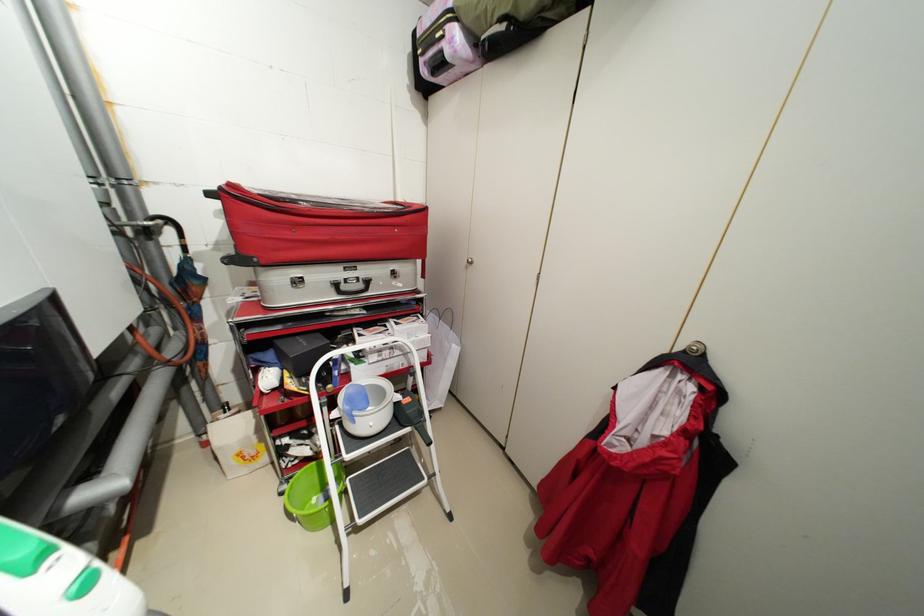
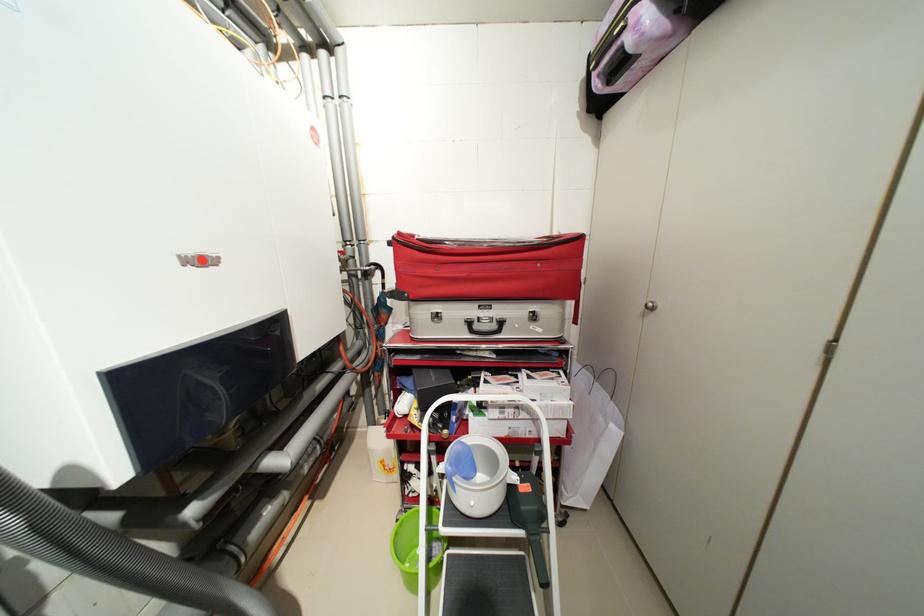
Find the pixel in the second image that matches (x=368, y=286) in the first image.

(502, 326)